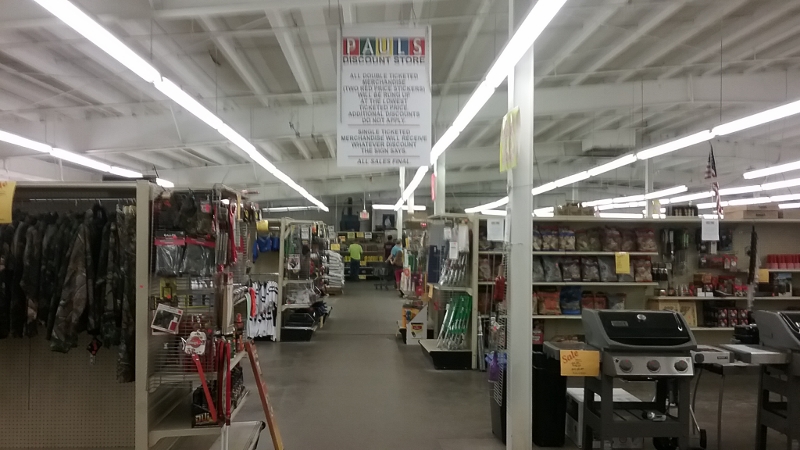
You are a GUI agent. You are given a task and a screenshot of the screen. Output one action in this format:
    pyautogui.click(x=<x>, y=<y>)
    Task: Click on the table
    The image size is (800, 450).
    Given the screenshot: What is the action you would take?
    pyautogui.click(x=722, y=373)